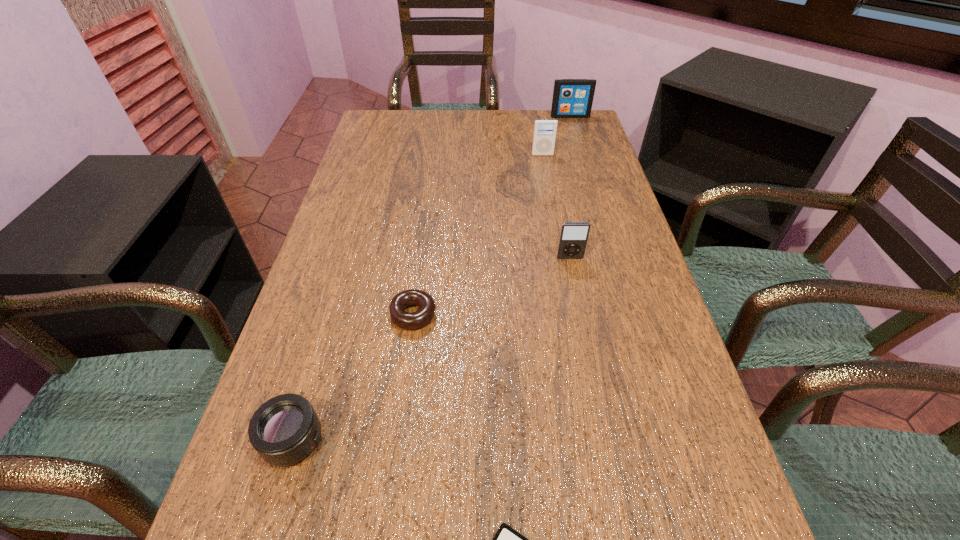
Find the location of a particular element. free spot that satisfies the following two spatial constraints: 1. on the front screen of the rightmost object; 2. on the side of the telephoto lens with brand markings and control switches is located at coordinates [668, 440].

Image resolution: width=960 pixels, height=540 pixels. In order to click on free location that satisfies the following two spatial constraints: 1. on the front screen of the farthest iPod; 2. on the side of the third shortest object with brand markings and control switches in this screenshot , I will do `click(668, 440)`.

This screenshot has height=540, width=960. What are the coordinates of `vacant area in the image that satisfies the following two spatial constraints: 1. on the front-facing side of the second farthest object; 2. on the side of the telephoto lens with brand markings and control switches` in the screenshot? It's located at (596, 440).